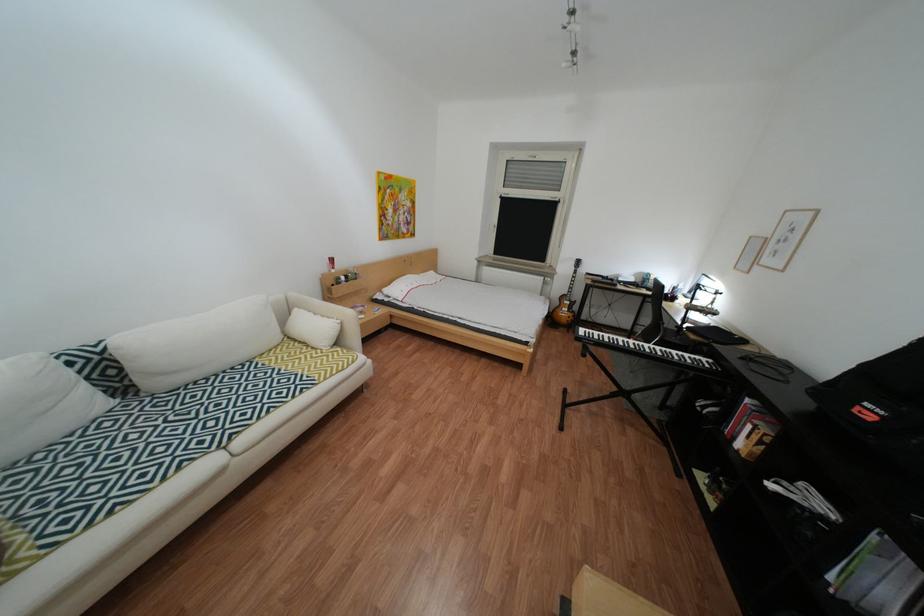
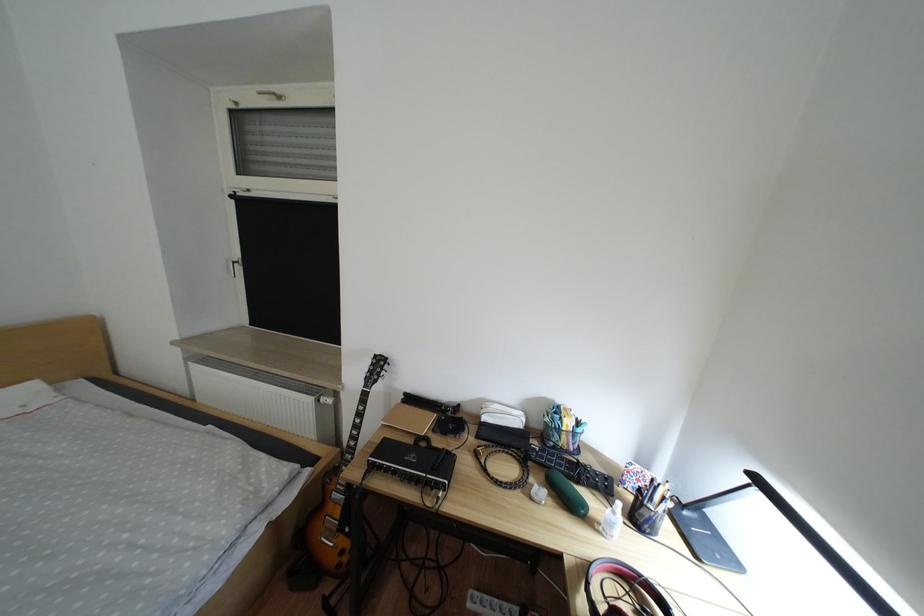
Which direction would the cameraman need to move to produce the second image?

The cameraman walked toward right, forward.